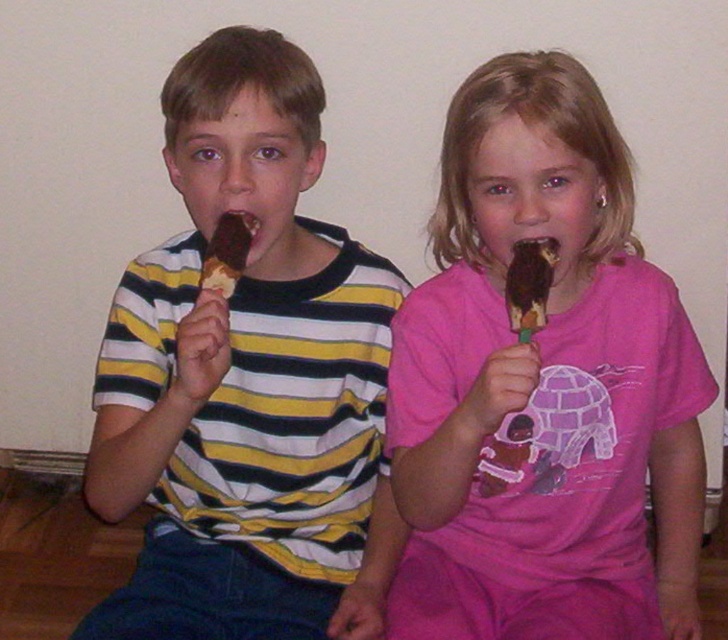
You are a photographer taking a picture of the two children. The chocolate coated ice cream at upper center is an important element in the frame. To ensure it stays centered in the photo, where should you focus your camera? Please provide coordinates based on the image grid system where the bottom left corner is the origin point.

The chocolate coated ice cream at upper center should be focused at its position at point [529,284] to keep it centered in the photo.

You are a parent trying to decide which ice cream to give to your child first. You see the chocolate coated ice cream at upper center and the chocolate ice cream at center. Which one is taller?

The chocolate coated ice cream at upper center is taller than the chocolate ice cream at center.

Based on the photo, you are a photographer taking a picture of the two children and their ice cream. You notice the matte chocolate ice cream bar at center and the chocolate coated ice cream at upper center. Which ice cream is closer to the camera?

The matte chocolate ice cream bar at center is closer to the camera than the chocolate coated ice cream at upper center because it is further to the viewer.